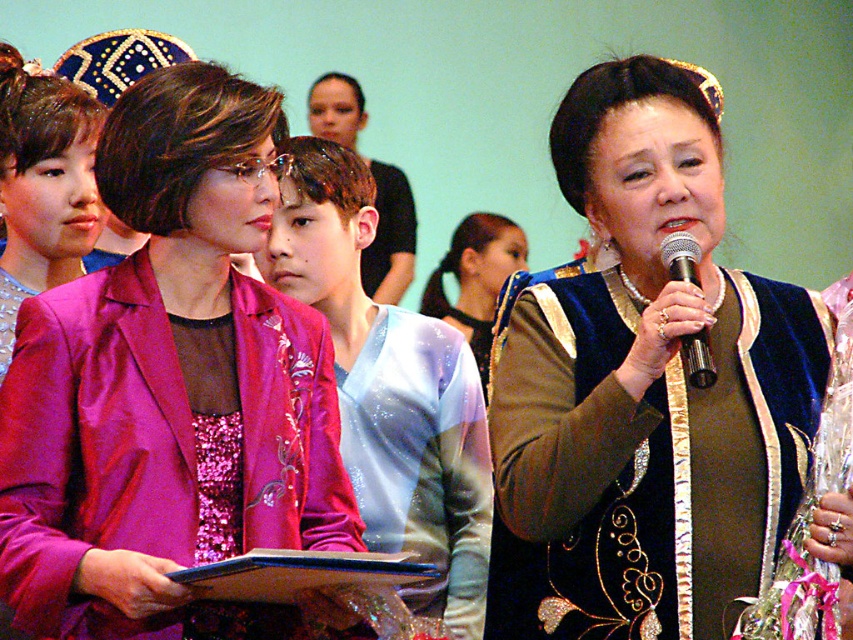
Question: Does pink satin jacket at center appear on the right side of metallic silver microphone at upper center?

Choices:
 (A) yes
 (B) no

Answer: (B)

Question: Observing the image, what is the correct spatial positioning of pink satin jacket at center in reference to velvet blue dress at center?

Choices:
 (A) right
 (B) left

Answer: (B)

Question: Which of the following is the closest to the observer?

Choices:
 (A) metallic silver microphone at upper center
 (B) pink satin jacket at center

Answer: (A)

Question: Which object appears closest to the camera in this image?

Choices:
 (A) pink satin jacket at center
 (B) velvet brown dress at center
 (C) velvet blue dress at center

Answer: (B)

Question: Where is velvet brown dress at center located in relation to metallic silver microphone at upper center in the image?

Choices:
 (A) right
 (B) left

Answer: (B)

Question: Which of the following is the farthest from the observer?

Choices:
 (A) velvet brown dress at center
 (B) metallic silver microphone at upper center
 (C) pink satin jacket at center
 (D) velvet blue dress at center

Answer: (D)